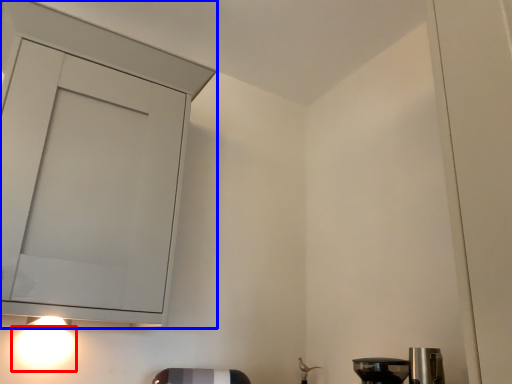
Question: Which point is further to the camera, light (highlighted by a red box) or cabinetry (highlighted by a blue box)?

Choices:
 (A) light
 (B) cabinetry

Answer: (A)